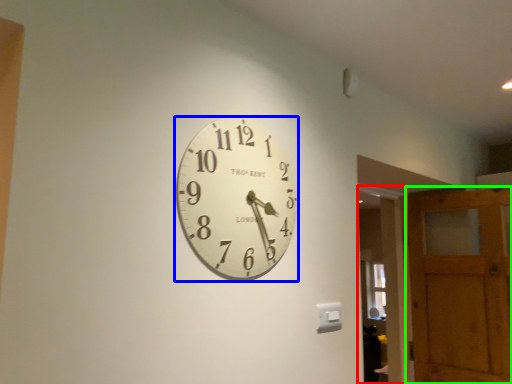
Question: Estimate the real-world distances between objects in this image. Which object is closer to glass door (highlighted by a red box), wall clock (highlighted by a blue box) or barn door (highlighted by a green box)?

Choices:
 (A) wall clock
 (B) barn door

Answer: (B)